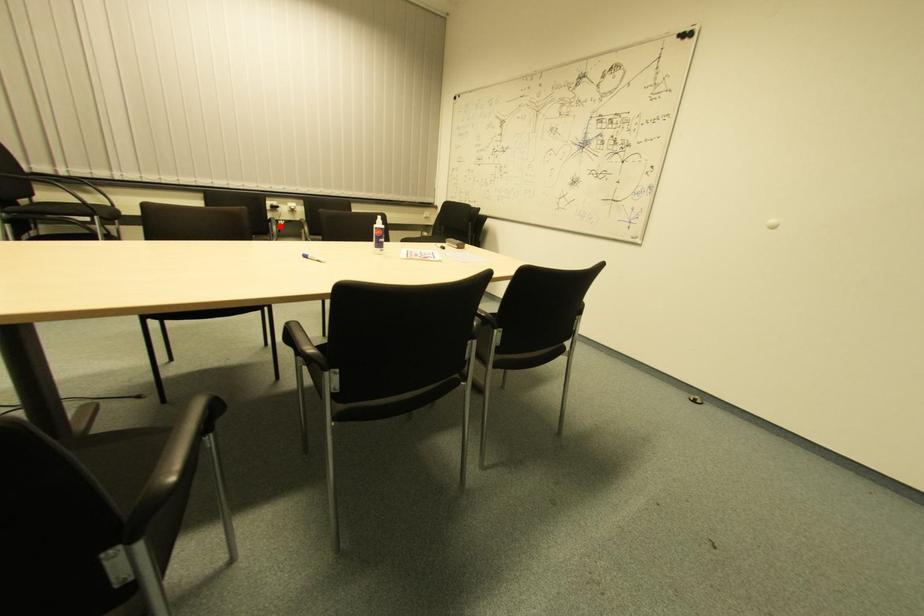
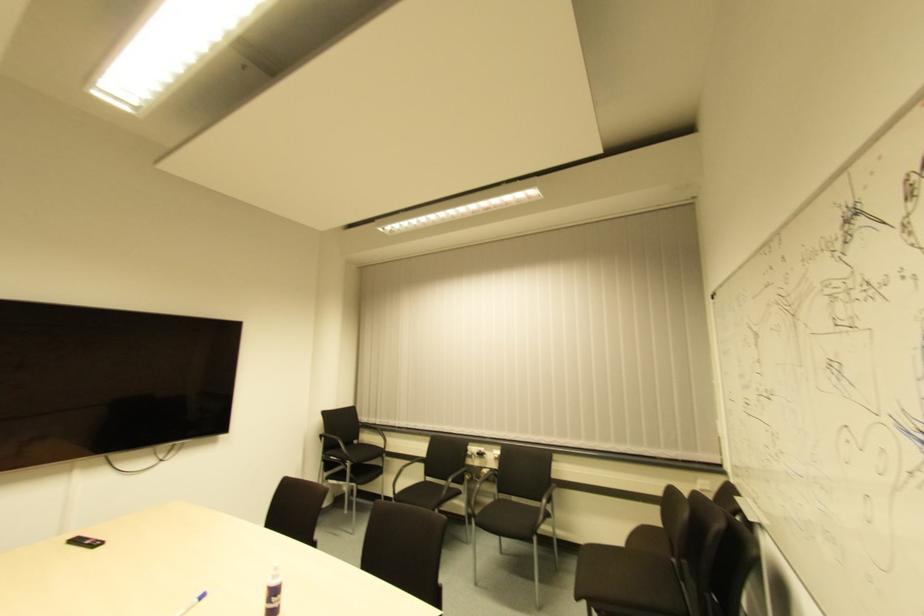
Where in the second image is the point corresponding to the highlighted location from the first image?

(483, 474)